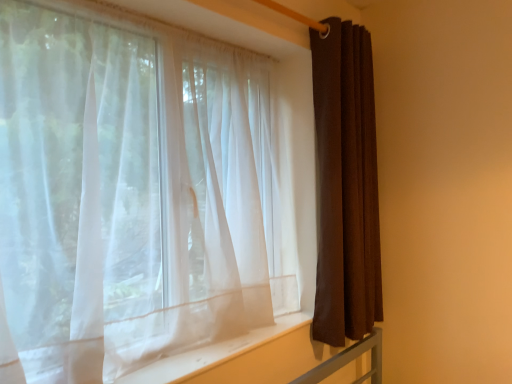
Question: Is brown fabric curtain at right, which is the 2th curtain from left to right, bigger or smaller than sheer white curtain at left, which is counted as the 1th curtain, starting from the left?

Choices:
 (A) small
 (B) big

Answer: (A)

Question: Is point (357, 135) closer or farther from the camera than point (84, 296)?

Choices:
 (A) closer
 (B) farther

Answer: (B)

Question: Which object is positioned closest to the brown fabric curtain at right, marked as the 1th curtain in a right-to-left arrangement?

Choices:
 (A) sheer white curtain at left, which is counted as the 1th curtain, starting from the left
 (B) white sheer fabric at lower center

Answer: (A)

Question: Which of these objects is positioned farthest from the brown fabric curtain at right, which is the 2th curtain from left to right?

Choices:
 (A) sheer white curtain at left, which is counted as the 1th curtain, starting from the left
 (B) white sheer fabric at lower center

Answer: (B)